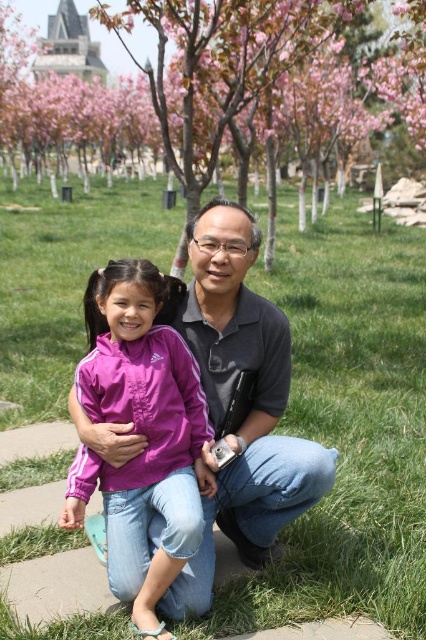
You are a gardener who needs to mow the lawn. The mower can only cut plants shorter than the pink blossoms at upper center. Will the green grass at center be cut by the mower?

The green grass at center is shorter than the pink blossoms at upper center, so the mower will not cut it because it is already shorter than the required height.

You are a photographer trying to capture a photo of the pink fabric jacket at center while also including the pink blossoms at upper center in the frame. Which object should you adjust your camera angle to focus on first to ensure both are visible?

To ensure both the pink blossoms at upper center and the pink fabric jacket at center are visible, adjust your camera angle to focus on the pink blossoms at upper center first since it is positioned to the left of the pink fabric jacket at center, allowing you to frame them together.